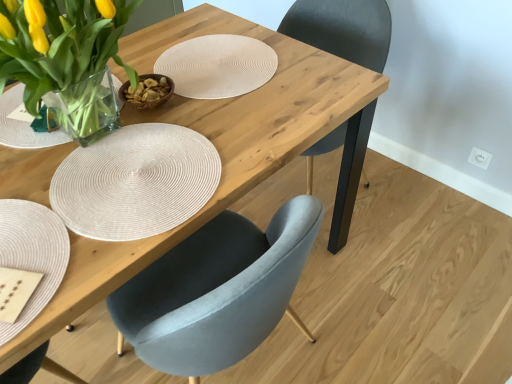
Question: Is beige woven placemat at lower left taller or shorter than clear glass vase at upper left?

Choices:
 (A) short
 (B) tall

Answer: (A)

Question: Is beige woven placemat at lower left inside the boundaries of clear glass vase at upper left, or outside?

Choices:
 (A) outside
 (B) inside

Answer: (A)

Question: Which is farther from the matte gray chair at center?

Choices:
 (A) beige woven placemat at lower left
 (B) clear glass vase at upper left

Answer: (A)

Question: Estimate the real-world distances between objects in this image. Which object is closer to the matte gray chair at center?

Choices:
 (A) clear glass vase at upper left
 (B) beige woven placemat at lower left

Answer: (A)